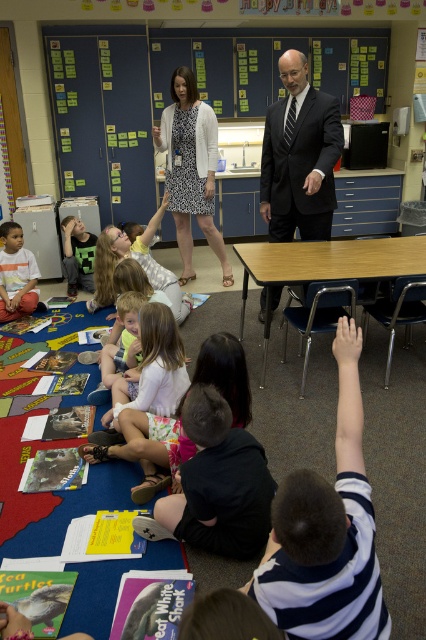
Question: Can you confirm if white textured dress at center is positioned to the right of matte plastic hand at lower right?

Choices:
 (A) yes
 (B) no

Answer: (B)

Question: Can you confirm if black suit at center is positioned below matte plastic hand at lower right?

Choices:
 (A) no
 (B) yes

Answer: (A)

Question: Which point appears farthest from the camera in this image?

Choices:
 (A) (229, 269)
 (B) (176, 385)
 (C) (284, 227)
 (D) (20, 280)

Answer: (A)

Question: Based on their relative distances, which object is nearer to the light brown striped shirt at lower left?

Choices:
 (A) white textured dress at center
 (B) white striped shirt at upper right

Answer: (A)

Question: Where is white striped shirt at upper right located in relation to black suit at center in the image?

Choices:
 (A) above
 (B) below

Answer: (B)

Question: Among these points, which one is nearest to the camera?

Choices:
 (A) (310, 97)
 (B) (166, 340)
 (C) (19, 316)
 (D) (339, 634)

Answer: (D)